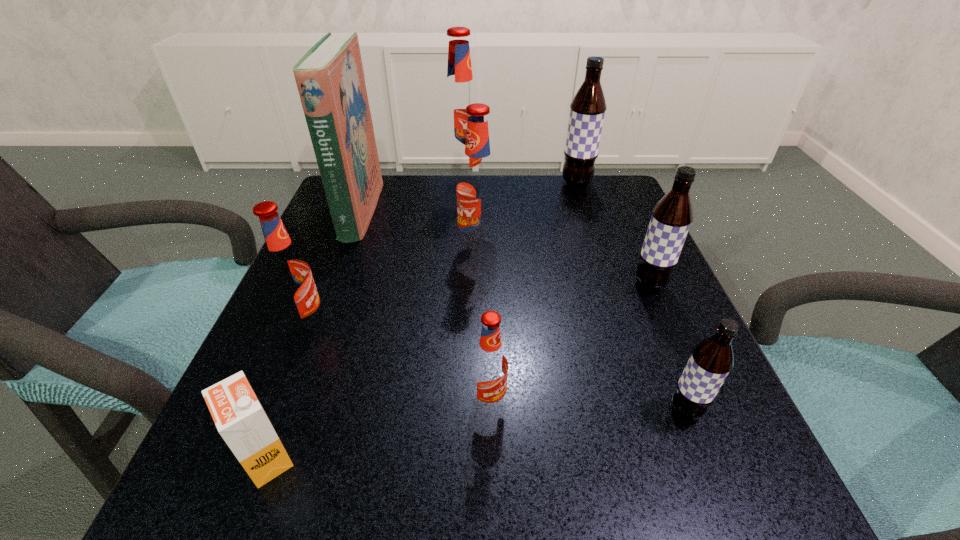
Image resolution: width=960 pixels, height=540 pixels. What are the coordinates of `the smallest red root beer` in the screenshot? It's located at (489, 364).

Where is `the nearest brown root beer`? Image resolution: width=960 pixels, height=540 pixels. the nearest brown root beer is located at coordinates (711, 360).

At what (x,y) coordinates should I click in order to perform the action: click on orange orange juice. Please return your answer as a coordinate pair (x, y). Looking at the image, I should click on (237, 413).

I want to click on orange juice, so click(x=237, y=413).

At what (x,y) coordinates should I click in order to perform the action: click on vacant area situated 0.200m on the left of the tallest root beer. Please return your answer as a coordinate pair (x, y). Image resolution: width=960 pixels, height=540 pixels. Looking at the image, I should click on (365, 185).

The image size is (960, 540). In order to click on vacant region located 0.050m on the cover of the hardback book in this screenshot , I will do (396, 211).

Find the location of a particular element. vacant point located on the front of the farthest brown root beer is located at coordinates (588, 215).

Where is `blank space located on the front of the third farthest root beer`? blank space located on the front of the third farthest root beer is located at coordinates (478, 281).

What are the coordinates of `free region located 0.200m on the back of the fifth farthest object` in the screenshot? It's located at (620, 217).

Locate an element on the screen. free space located 0.250m on the back of the second nearest red root beer is located at coordinates (345, 231).